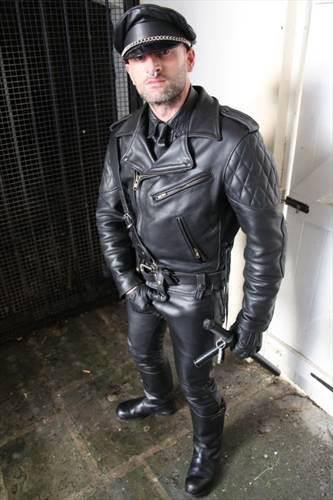
Locate an element on the screen. The image size is (333, 500). farmhouse door is located at coordinates (320, 150).